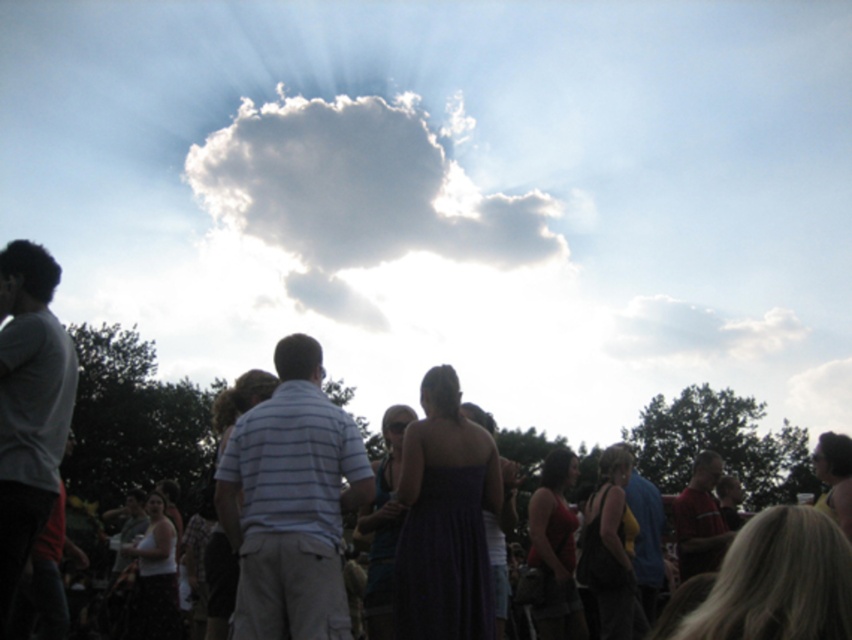
Question: Which object is the farthest from the white striped shirt at center?

Choices:
 (A) purple satin dress at center
 (B) silhouette human at center
 (C) light gray cotton shirt at left
 (D) white fluffy cloud at upper center

Answer: (D)

Question: Is white striped shirt at center to the left of light gray cotton shirt at left from the viewer's perspective?

Choices:
 (A) yes
 (B) no

Answer: (B)

Question: Which point is farther from the camera taking this photo?

Choices:
 (A) (136, 344)
 (B) (346, 614)
 (C) (30, 323)
 (D) (421, 582)

Answer: (A)

Question: Considering the relative positions of white fluffy cloud at upper center and purple satin dress at center in the image provided, where is white fluffy cloud at upper center located with respect to purple satin dress at center?

Choices:
 (A) left
 (B) right

Answer: (A)

Question: Which object is closer to the camera taking this photo?

Choices:
 (A) silhouette human at center
 (B) purple satin dress at center

Answer: (A)

Question: Observing the image, what is the correct spatial positioning of silhouette human at center in reference to white fluffy cloud at upper center?

Choices:
 (A) below
 (B) above

Answer: (A)